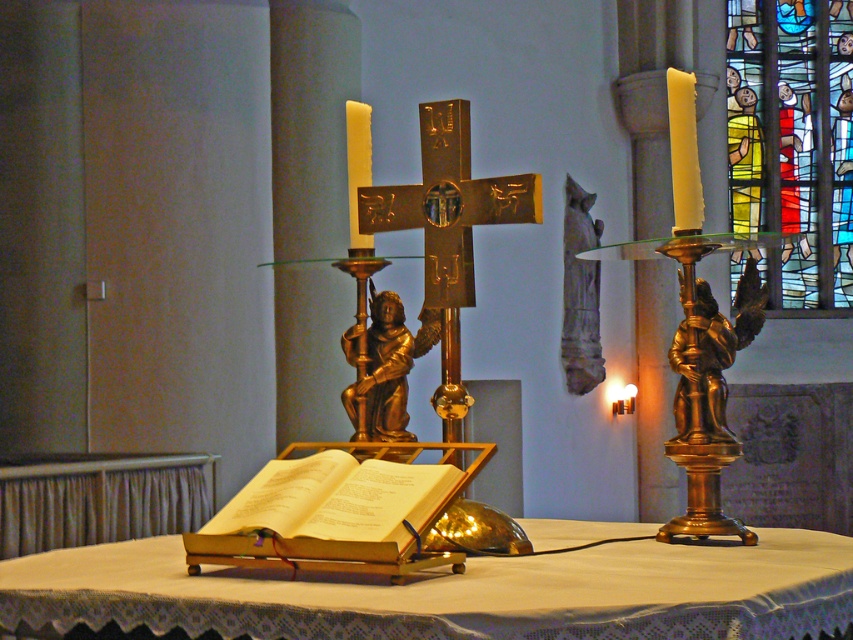
Does gold textured table at center come in front of gold polished angel at right?

Yes, gold textured table at center is closer to the viewer.

Can you confirm if gold textured table at center is bigger than gold polished angel at right?

Yes, gold textured table at center is bigger than gold polished angel at right.

Between point (751, 627) and point (709, 420), which one is positioned in front?

Point (751, 627) is in front.

Locate an element on the screen. Image resolution: width=853 pixels, height=640 pixels. gold textured table at center is located at coordinates pyautogui.click(x=450, y=593).

Image resolution: width=853 pixels, height=640 pixels. Describe the element at coordinates (793, 141) in the screenshot. I see `stained glass figures at upper right` at that location.

Which is in front, point (780, 3) or point (364, 163)?

Positioned in front is point (364, 163).

The width and height of the screenshot is (853, 640). In order to click on stained glass figures at upper right in this screenshot , I will do tap(793, 141).

Does gold polished angel statue at right have a greater height compared to gold polished angel at right?

No.

Between gold polished angel statue at right and gold polished angel at right, which one is positioned lower?

gold polished angel at right

This screenshot has width=853, height=640. Describe the element at coordinates (695, 381) in the screenshot. I see `gold polished angel statue at right` at that location.

Locate an element on the screen. The width and height of the screenshot is (853, 640). gold polished angel statue at right is located at coordinates (695, 381).